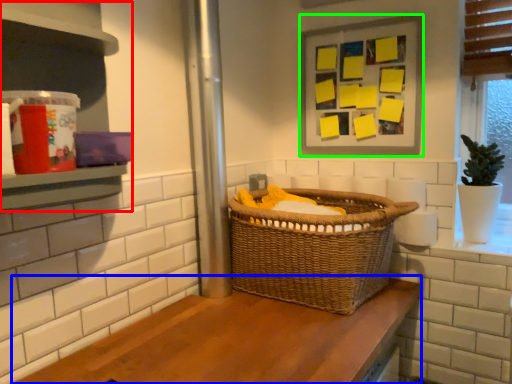
Question: Estimate the real-world distances between objects in this image. Which object is farther from shelf (highlighted by a red box), counter (highlighted by a blue box) or picture frame (highlighted by a green box)?

Choices:
 (A) counter
 (B) picture frame

Answer: (B)